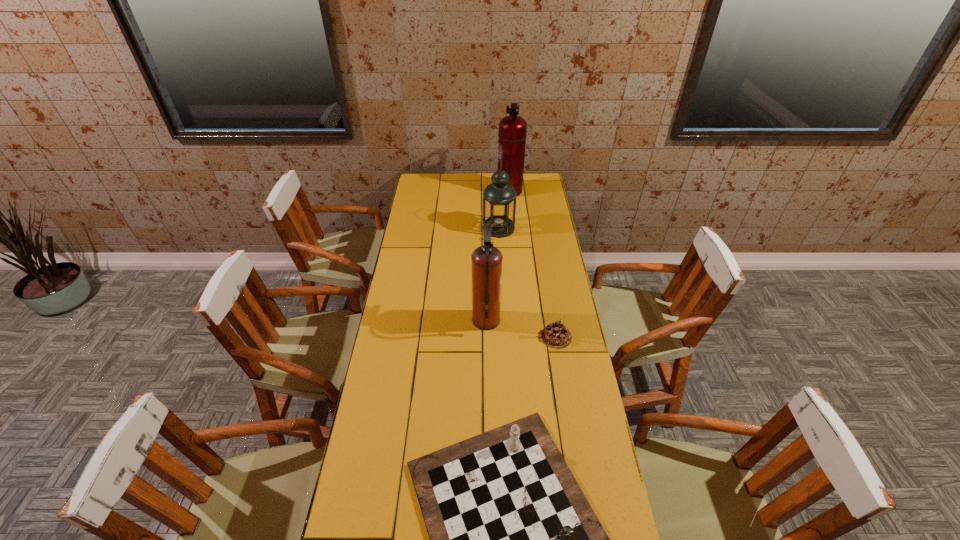
At what (x,y) coordinates should I click in order to perform the action: click on the farthest object. Please return your answer as a coordinate pair (x, y). The height and width of the screenshot is (540, 960). Looking at the image, I should click on (512, 135).

In order to click on the tallest object in this screenshot , I will do `click(512, 135)`.

I want to click on the nearer fire extinguisher, so click(x=486, y=260).

The height and width of the screenshot is (540, 960). Identify the location of the left fire extinguisher. (486, 260).

The height and width of the screenshot is (540, 960). Identify the location of oil lamp. (499, 198).

The image size is (960, 540). Identify the location of the shortest object. (555, 335).

Where is `vacant space located on the nozzle side of the tallest object`? Image resolution: width=960 pixels, height=540 pixels. vacant space located on the nozzle side of the tallest object is located at coordinates (440, 191).

Find the location of `vacant region located 0.060m on the nozzle side of the tallest object`. vacant region located 0.060m on the nozzle side of the tallest object is located at coordinates (486, 191).

I want to click on vacant area situated 0.160m on the nozzle side of the tallest object, so click(x=468, y=191).

Locate an element on the screen. vacant space located 0.100m at the nozzle of the nearer fire extinguisher is located at coordinates (446, 320).